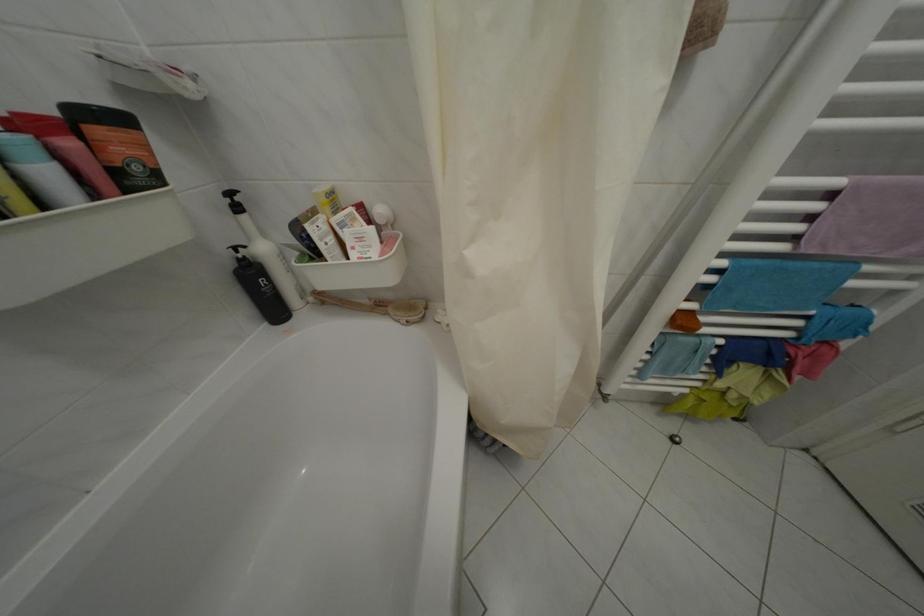
The location [326,200] corresponds to which object?

It corresponds to the yellow product box in the image.